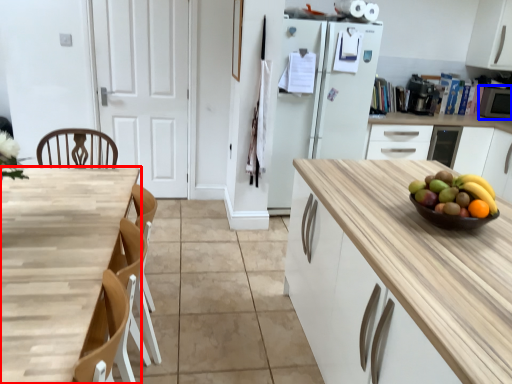
Question: Which object is closer to the camera taking this photo, countertop (highlighted by a red box) or appliance (highlighted by a blue box)?

Choices:
 (A) countertop
 (B) appliance

Answer: (A)